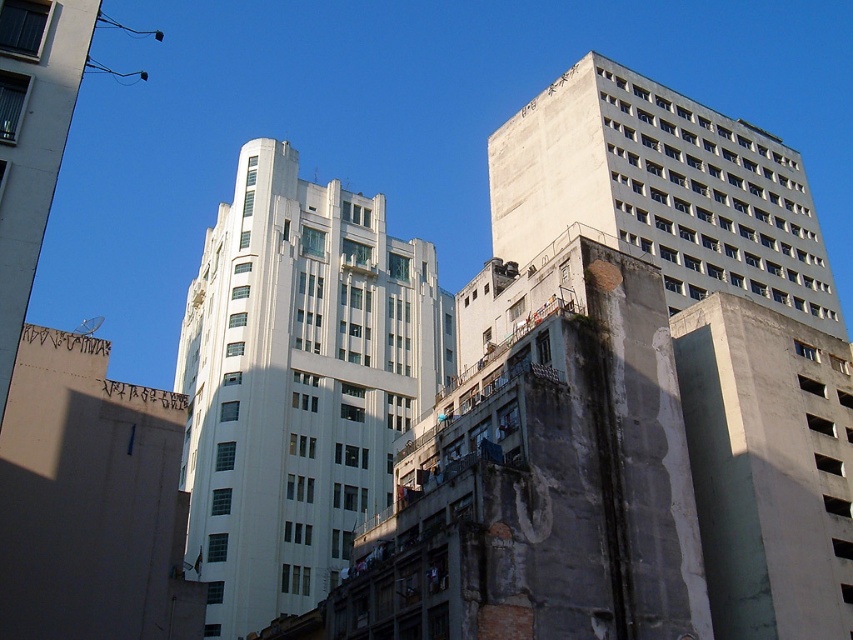
Question: Does white smooth building at center appear on the left side of concrete building at upper right?

Choices:
 (A) no
 (B) yes

Answer: (B)

Question: Which of the following is the closest to the observer?

Choices:
 (A) (532, 257)
 (B) (341, 288)

Answer: (A)

Question: Is white smooth building at center above concrete building at upper right?

Choices:
 (A) no
 (B) yes

Answer: (A)

Question: Which object is closer to the camera taking this photo?

Choices:
 (A) white smooth building at center
 (B) concrete building at upper right

Answer: (A)

Question: Which point is closer to the camera?

Choices:
 (A) concrete building at upper right
 (B) white smooth building at center

Answer: (B)

Question: Does white smooth building at center have a smaller size compared to concrete building at upper right?

Choices:
 (A) no
 (B) yes

Answer: (A)